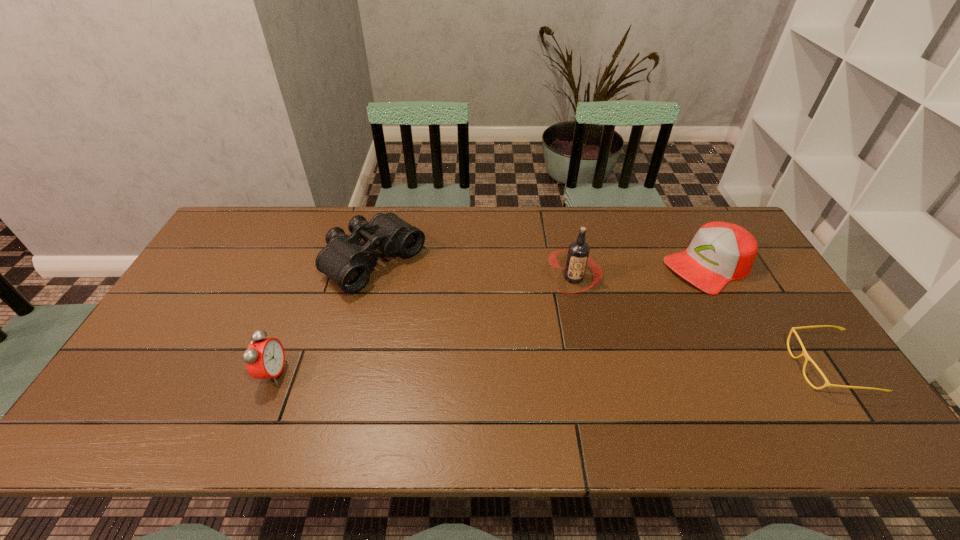
The image size is (960, 540). Find the location of `baseball cap positioned at the far edge`. baseball cap positioned at the far edge is located at coordinates (720, 252).

This screenshot has width=960, height=540. Find the location of `alarm clock at the near edge`. alarm clock at the near edge is located at coordinates (264, 358).

Find the location of a particular element. Image resolution: width=960 pixels, height=540 pixels. spectacles that is positioned at the near edge is located at coordinates (807, 358).

Find the location of a particular element. spectacles that is at the right edge is located at coordinates (807, 358).

This screenshot has height=540, width=960. Find the location of `baseball cap present at the right edge`. baseball cap present at the right edge is located at coordinates (720, 252).

At what (x,y) coordinates should I click in order to perform the action: click on object located at the far right corner. Please return your answer as a coordinate pair (x, y). Looking at the image, I should click on (720, 252).

The image size is (960, 540). I want to click on object located at the near right corner, so click(x=807, y=358).

Where is `vacant area at the far edge`? The height and width of the screenshot is (540, 960). vacant area at the far edge is located at coordinates (463, 212).

The height and width of the screenshot is (540, 960). In the image, there is a desktop. What are the coordinates of `vacant space at the near edge` in the screenshot? It's located at (373, 374).

This screenshot has height=540, width=960. I want to click on free space at the left edge of the desktop, so click(x=184, y=347).